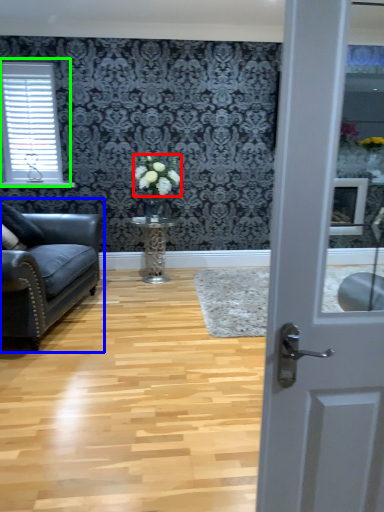
Question: Estimate the real-world distances between objects in this image. Which object is farther from flower (highlighted by a red box), studio couch (highlighted by a blue box) or window (highlighted by a green box)?

Choices:
 (A) studio couch
 (B) window

Answer: (B)